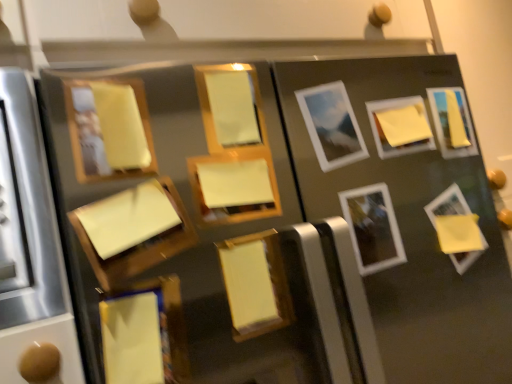
What do you see at coordinates (255, 284) in the screenshot? I see `yellow matte picture frame at center, the sixth picture frame from the right` at bounding box center [255, 284].

What do you see at coordinates (447, 204) in the screenshot? I see `yellow matte picture frame at lower right, which is counted as the 10th picture frame, starting from the left` at bounding box center [447, 204].

Where is `yellow matte picture frame at lower right, which is the 2th picture frame from right to left`? yellow matte picture frame at lower right, which is the 2th picture frame from right to left is located at coordinates (447, 204).

Find the location of a particular element. Image resolution: width=512 pixels, height=384 pixels. matte wood picture frame at upper left, which ranks as the first picture frame in left-to-right order is located at coordinates (109, 129).

Considering the relative sizes of yellow matte picture frame at upper right, which ranks as the third picture frame in right-to-left order, and yellow matte picture frame at center, acting as the sixth picture frame starting from the left, in the image provided, is yellow matte picture frame at upper right, which ranks as the third picture frame in right-to-left order, wider than yellow matte picture frame at center, acting as the sixth picture frame starting from the left,?

Yes.

Considering the positions of objects yellow matte picture frame at upper right, placed as the 9th picture frame when sorted from left to right, and yellow matte picture frame at center, the sixth picture frame from the right, in the image provided, who is more to the right, yellow matte picture frame at upper right, placed as the 9th picture frame when sorted from left to right, or yellow matte picture frame at center, the sixth picture frame from the right,?

yellow matte picture frame at upper right, placed as the 9th picture frame when sorted from left to right.

Could yellow matte picture frame at center, acting as the sixth picture frame starting from the left, be considered to be inside yellow matte picture frame at upper right, placed as the 9th picture frame when sorted from left to right?

No, yellow matte picture frame at center, acting as the sixth picture frame starting from the left, is located outside of yellow matte picture frame at upper right, placed as the 9th picture frame when sorted from left to right.

Can you tell me how much matte white picture frame at center, the fifth picture frame from the right, and matte yellow picture frame at center, which is the 8th picture frame in right-to-left order, differ in facing direction?

They differ by 1.14 degrees in their facing directions.

Is point (320, 111) closer or farther from the camera than point (209, 78)?

Point (320, 111) appears to be farther away from the viewer than point (209, 78).

Find the location of `the 1st picture frame behind the matte yellow picture frame at center, placed as the fourth picture frame when sorted from left to right`. the 1st picture frame behind the matte yellow picture frame at center, placed as the fourth picture frame when sorted from left to right is located at coordinates (332, 125).

Which object is wider, matte white picture frame at center, which appears as the 7th picture frame when viewed from the left, or matte yellow picture frame at center, which is the 8th picture frame in right-to-left order?

Wider between the two is matte white picture frame at center, which appears as the 7th picture frame when viewed from the left.

Does yellow matte picture frame at lower left, the ninth picture frame in the right-to-left sequence, have a greater height compared to yellow matte picture frame at upper right, which ranks as the third picture frame in right-to-left order?

Indeed, yellow matte picture frame at lower left, the ninth picture frame in the right-to-left sequence, has a greater height compared to yellow matte picture frame at upper right, which ranks as the third picture frame in right-to-left order.

From the image's perspective, is yellow matte picture frame at lower left, the ninth picture frame in the right-to-left sequence, under yellow matte picture frame at upper right, placed as the 9th picture frame when sorted from left to right?

Correct, yellow matte picture frame at lower left, the ninth picture frame in the right-to-left sequence, appears lower than yellow matte picture frame at upper right, placed as the 9th picture frame when sorted from left to right, in the image.

Is yellow matte picture frame at lower left, which ranks as the third picture frame in left-to-right order, at the left side of yellow matte picture frame at upper right, placed as the 9th picture frame when sorted from left to right?

Correct, you'll find yellow matte picture frame at lower left, which ranks as the third picture frame in left-to-right order, to the left of yellow matte picture frame at upper right, placed as the 9th picture frame when sorted from left to right.

Is yellow matte picture frame at lower right, which is counted as the 10th picture frame, starting from the left, in contact with yellow matte picture frame at center, acting as the sixth picture frame starting from the left?

No.

Is yellow matte picture frame at lower right, which is counted as the 10th picture frame, starting from the left, completely or partially outside of yellow matte picture frame at center, acting as the sixth picture frame starting from the left?

Yes, yellow matte picture frame at lower right, which is counted as the 10th picture frame, starting from the left, is located beyond the bounds of yellow matte picture frame at center, acting as the sixth picture frame starting from the left.

Considering the sizes of objects yellow matte picture frame at lower right, which is the 2th picture frame from right to left, and yellow matte picture frame at center, acting as the sixth picture frame starting from the left, in the image provided, who is smaller, yellow matte picture frame at lower right, which is the 2th picture frame from right to left, or yellow matte picture frame at center, acting as the sixth picture frame starting from the left,?

yellow matte picture frame at center, acting as the sixth picture frame starting from the left, is smaller.

Is yellow matte picture frame at lower right, which is counted as the 10th picture frame, starting from the left, in front of or behind yellow matte picture frame at center, acting as the sixth picture frame starting from the left, in the image?

yellow matte picture frame at lower right, which is counted as the 10th picture frame, starting from the left, is positioned farther from the viewer than yellow matte picture frame at center, acting as the sixth picture frame starting from the left.

I want to click on the 2nd picture frame above when counting from the matte wood picture frame at upper left, which is counted as the eleventh picture frame, starting from the right (from the image's perspective), so click(x=400, y=126).

Which of these two, matte wood picture frame at upper left, which ranks as the first picture frame in left-to-right order, or yellow matte picture frame at upper right, placed as the 9th picture frame when sorted from left to right, is thinner?

yellow matte picture frame at upper right, placed as the 9th picture frame when sorted from left to right.

From their relative heights in the image, would you say matte wood picture frame at upper left, which is counted as the eleventh picture frame, starting from the right, is taller or shorter than yellow matte picture frame at upper right, placed as the 9th picture frame when sorted from left to right?

Clearly, matte wood picture frame at upper left, which is counted as the eleventh picture frame, starting from the right, is taller compared to yellow matte picture frame at upper right, placed as the 9th picture frame when sorted from left to right.

Does yellow matte picture frame at lower left, which ranks as the third picture frame in left-to-right order, have a smaller size compared to matte wood picture frame at center, positioned as the 7th picture frame in right-to-left order?

No, yellow matte picture frame at lower left, which ranks as the third picture frame in left-to-right order, is not smaller than matte wood picture frame at center, positioned as the 7th picture frame in right-to-left order.

From the picture: From the image's perspective, is yellow matte picture frame at lower left, the ninth picture frame in the right-to-left sequence, located above or below matte wood picture frame at center, positioned as the 7th picture frame in right-to-left order?

Based on their image positions, yellow matte picture frame at lower left, the ninth picture frame in the right-to-left sequence, is located beneath matte wood picture frame at center, positioned as the 7th picture frame in right-to-left order.

Is yellow matte picture frame at lower left, which ranks as the third picture frame in left-to-right order, directly adjacent to matte wood picture frame at center, positioned as the 7th picture frame in right-to-left order?

No, yellow matte picture frame at lower left, which ranks as the third picture frame in left-to-right order, is not beside matte wood picture frame at center, positioned as the 7th picture frame in right-to-left order.

Considering the points (242, 316) and (418, 129), which point is in front, point (242, 316) or point (418, 129)?

Point (242, 316)

Does yellow matte picture frame at center, acting as the sixth picture frame starting from the left, appear on the right side of yellow matte picture frame at upper right, which ranks as the third picture frame in right-to-left order?

No, yellow matte picture frame at center, acting as the sixth picture frame starting from the left, is not to the right of yellow matte picture frame at upper right, which ranks as the third picture frame in right-to-left order.

Is yellow matte picture frame at center, the sixth picture frame from the right, wider than yellow matte picture frame at upper right, which ranks as the third picture frame in right-to-left order?

Incorrect, the width of yellow matte picture frame at center, the sixth picture frame from the right, does not surpass that of yellow matte picture frame at upper right, which ranks as the third picture frame in right-to-left order.

From a real-world perspective, is yellow matte picture frame at center, the sixth picture frame from the right, positioned above or below yellow matte picture frame at upper right, which ranks as the third picture frame in right-to-left order?

Clearly, from a real-world perspective, yellow matte picture frame at center, the sixth picture frame from the right, is below yellow matte picture frame at upper right, which ranks as the third picture frame in right-to-left order.

From the image's perspective, starting from the yellow matte picture frame at center, the sixth picture frame from the right, which picture frame is the 7th one above? Please provide its 2D coordinates.

[(400, 126)]

You are a GUI agent. You are given a task and a screenshot of the screen. Output one action in this format:
    pyautogui.click(x=<x>, y=<y>)
    Task: Click on the picture frame that is the 1st object located in front of the matte white picture frame at center, which appears as the 7th picture frame when viewed from the left
    
    Given the screenshot: What is the action you would take?
    pyautogui.click(x=230, y=107)

Which object lies further to the anchor point matte wood picture frame at upper left, which ranks as the first picture frame in left-to-right order, white glossy picture frame at center-right, the eighth picture frame from the left, or yellow matte picture frame at lower right, which is counted as the 10th picture frame, starting from the left?

yellow matte picture frame at lower right, which is counted as the 10th picture frame, starting from the left, is positioned further to the anchor matte wood picture frame at upper left, which ranks as the first picture frame in left-to-right order.

Looking at this image, based on their spatial positions, is matte wood picture frame at center, positioned as the 7th picture frame in right-to-left order, or yellow matte picture frame at center, the sixth picture frame from the right, closer to matte wood picture frame at center-left, which ranks as the tenth picture frame in right-to-left order?

matte wood picture frame at center, positioned as the 7th picture frame in right-to-left order, lies closer to matte wood picture frame at center-left, which ranks as the tenth picture frame in right-to-left order, than the other object.

When comparing their distances from matte white picture frame at center, which appears as the 7th picture frame when viewed from the left, does yellow matte picture frame at upper right, the 1th picture frame viewed from the right, or yellow matte picture frame at lower right, which is the 2th picture frame from right to left, seem further?

yellow matte picture frame at lower right, which is the 2th picture frame from right to left.

Based on their spatial positions, is matte yellow picture frame at center, which is the 8th picture frame in right-to-left order, or yellow matte picture frame at lower left, which ranks as the third picture frame in left-to-right order, closer to matte wood picture frame at center, positioned as the 7th picture frame in right-to-left order?

matte yellow picture frame at center, which is the 8th picture frame in right-to-left order.

Estimate the real-world distances between objects in this image. Which object is further from matte yellow picture frame at center, placed as the fourth picture frame when sorted from left to right, matte wood picture frame at upper left, which ranks as the first picture frame in left-to-right order, or matte white picture frame at center, which appears as the 7th picture frame when viewed from the left?

Among the two, matte wood picture frame at upper left, which ranks as the first picture frame in left-to-right order, is located further to matte yellow picture frame at center, placed as the fourth picture frame when sorted from left to right.

Looking at the image, which one is located further to yellow matte picture frame at upper right, which is counted as the eleventh picture frame, starting from the left, white glossy picture frame at center-right, the eighth picture frame from the left, or yellow matte picture frame at upper right, placed as the 9th picture frame when sorted from left to right?

Based on the image, white glossy picture frame at center-right, the eighth picture frame from the left, appears to be further to yellow matte picture frame at upper right, which is counted as the eleventh picture frame, starting from the left.

When comparing their distances from yellow matte picture frame at center, the sixth picture frame from the right, does yellow matte picture frame at upper right, placed as the 9th picture frame when sorted from left to right, or yellow matte picture frame at lower right, which is counted as the 10th picture frame, starting from the left, seem further?

yellow matte picture frame at lower right, which is counted as the 10th picture frame, starting from the left, is positioned further to the anchor yellow matte picture frame at center, the sixth picture frame from the right.

Looking at the image, which one is located closer to yellow matte picture frame at lower right, which is counted as the 10th picture frame, starting from the left, matte yellow picture frame at center, which is the 8th picture frame in right-to-left order, or matte wood picture frame at upper left, which ranks as the first picture frame in left-to-right order?

matte yellow picture frame at center, which is the 8th picture frame in right-to-left order, is positioned closer to the anchor yellow matte picture frame at lower right, which is counted as the 10th picture frame, starting from the left.